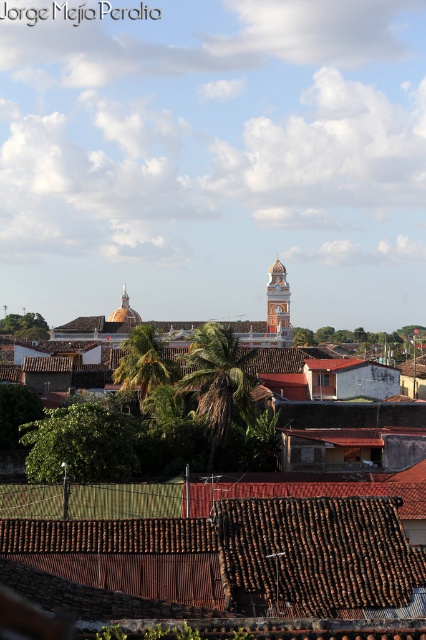
Question: Which point appears closest to the camera in this image?

Choices:
 (A) (334, 490)
 (B) (273, 273)
 (C) (362, 564)

Answer: (C)

Question: Does brown corrugated roof at center have a greater width compared to brown corrugated tile roof at lower center?

Choices:
 (A) yes
 (B) no

Answer: (A)

Question: Among these points, which one is nearest to the camera?

Choices:
 (A) (278, 285)
 (B) (354, 563)
 (C) (62, 529)

Answer: (B)

Question: Estimate the real-world distances between objects in this image. Which object is closer to the brown corrugated tile roof at lower center?

Choices:
 (A) orange painted stone clock tower at center
 (B) brown corrugated roof at center

Answer: (B)

Question: Can you confirm if brown corrugated roof at center is positioned to the left of orange painted stone clock tower at center?

Choices:
 (A) no
 (B) yes

Answer: (B)

Question: Can you confirm if brown corrugated roof at center is smaller than orange painted stone clock tower at center?

Choices:
 (A) no
 (B) yes

Answer: (A)